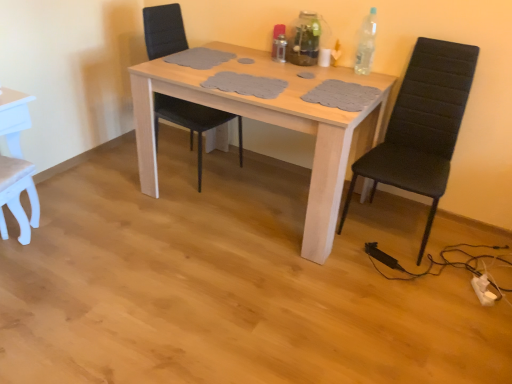
Identify the location of vacant space in between transparent glass vase at upper center, the 2th bottle in the left-to-right sequence, and clear plastic bottle at upper right, the 3th bottle viewed from the left. The width and height of the screenshot is (512, 384). 340,70.